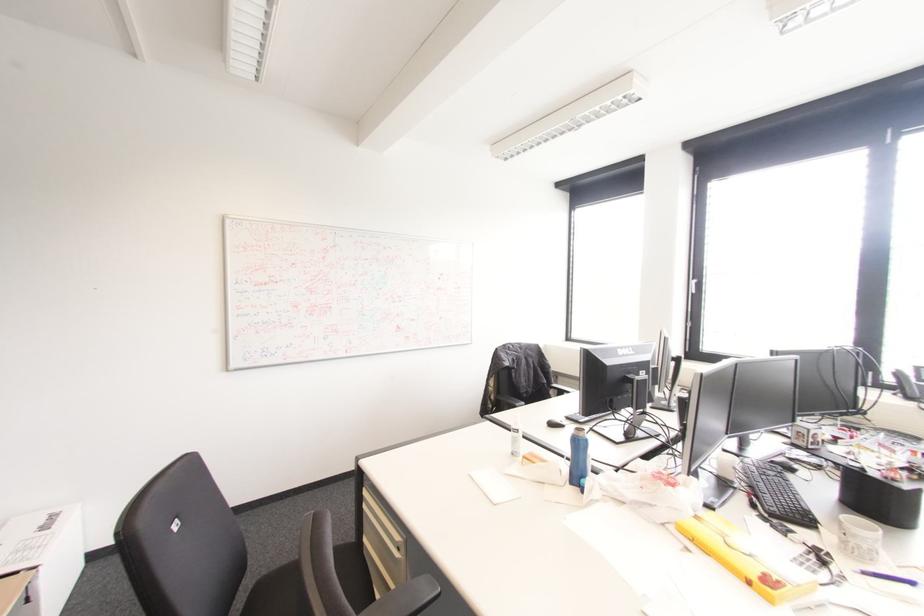
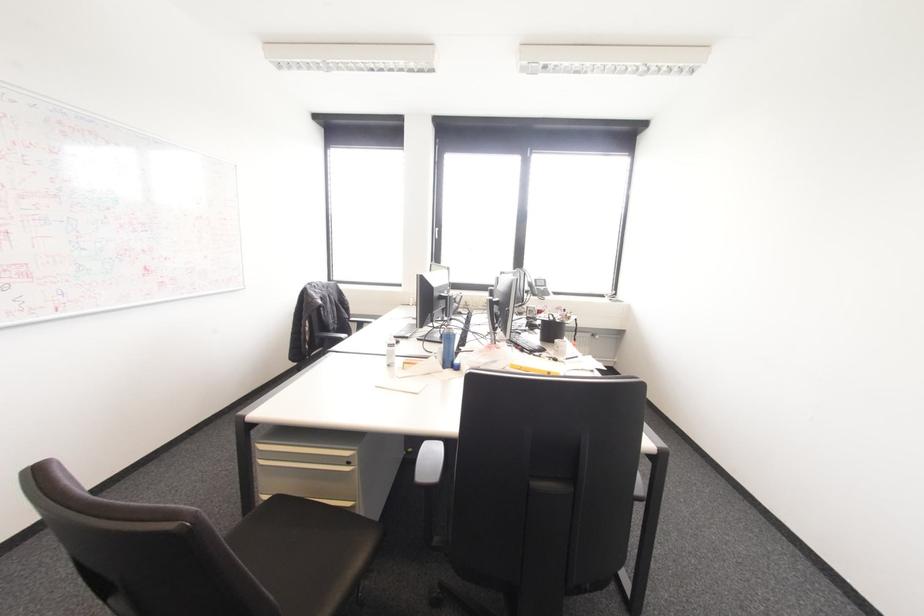
Question: The camera is either moving clockwise (left) or counter-clockwise (right) around the object. The first image is from the beginning of the video and the second image is from the end. Is the camera moving left or right when shooting the video?

Choices:
 (A) Left
 (B) Right

Answer: (A)